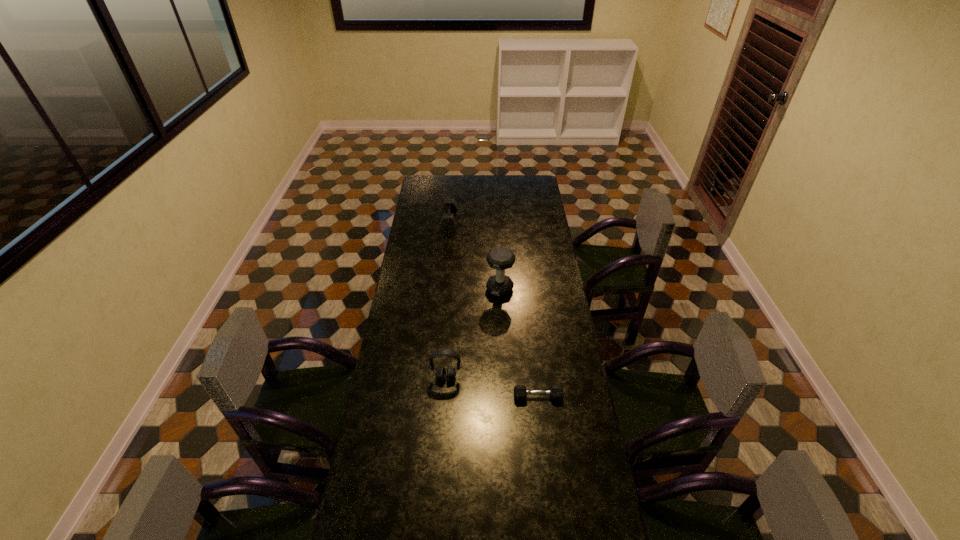
Locate an element on the screen. vacant space situated 0.160m on the left of the farthest dumbbell is located at coordinates (412, 222).

Where is `free space located 0.110m on the back of the nearest object`? free space located 0.110m on the back of the nearest object is located at coordinates (535, 367).

Locate an element on the screen. Image resolution: width=960 pixels, height=540 pixels. object present at the left edge is located at coordinates (447, 222).

This screenshot has height=540, width=960. I want to click on object that is at the right edge, so click(556, 392).

Locate an element on the screen. vacant point at the far edge is located at coordinates (510, 176).

The width and height of the screenshot is (960, 540). I want to click on free space at the left edge of the desktop, so pos(396,361).

Where is `vacant space at the right edge of the desktop`? The image size is (960, 540). vacant space at the right edge of the desktop is located at coordinates (529, 251).

You are a GUI agent. You are given a task and a screenshot of the screen. Output one action in this format:
    pyautogui.click(x=<x>, y=<y>)
    Task: Click on the free space between the nearest object and the farthest object
    This screenshot has width=960, height=540.
    Given the screenshot: What is the action you would take?
    pyautogui.click(x=493, y=309)

Find the location of a particular element. This screenshot has height=540, width=960. vacant region between the nearest dumbbell and the third tallest object is located at coordinates (493, 309).

Image resolution: width=960 pixels, height=540 pixels. Identify the location of vacant space that is in between the second farthest object and the third farthest object. pyautogui.click(x=473, y=334).